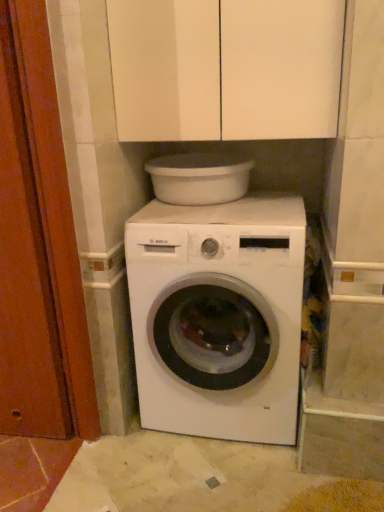
Question: Which is correct: white plastic basin at upper center is inside white matte washing machine at center, or outside of it?

Choices:
 (A) inside
 (B) outside

Answer: (B)

Question: In terms of height, does white plastic basin at upper center look taller or shorter compared to white matte washing machine at center?

Choices:
 (A) tall
 (B) short

Answer: (B)

Question: Which of these objects is positioned closest to the wooden door at left?

Choices:
 (A) white matte cabinet at upper center
 (B) white matte washing machine at center
 (C) white plastic basin at upper center

Answer: (B)

Question: Estimate the real-world distances between objects in this image. Which object is farther from the white matte cabinet at upper center?

Choices:
 (A) wooden door at left
 (B) white plastic basin at upper center
 (C) white matte washing machine at center

Answer: (C)